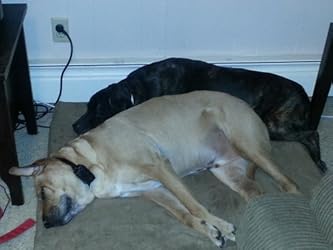
In order to click on electrical outlet in this screenshot , I will do `click(61, 33)`.